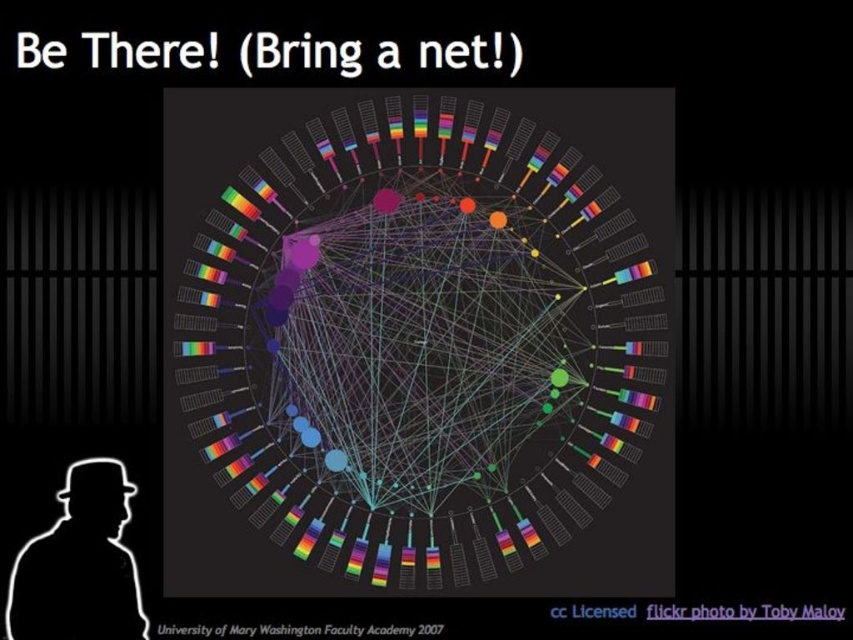
Does point (505, 432) come farther from viewer compared to point (79, 493)?

No.

Is point (579, 253) in front of point (102, 568)?

No, it is not.

What do you see at coordinates (418, 339) in the screenshot? This screenshot has width=853, height=640. I see `rainbow plastic network at center` at bounding box center [418, 339].

Identify the location of rainbow plastic network at center. The image size is (853, 640). (418, 339).